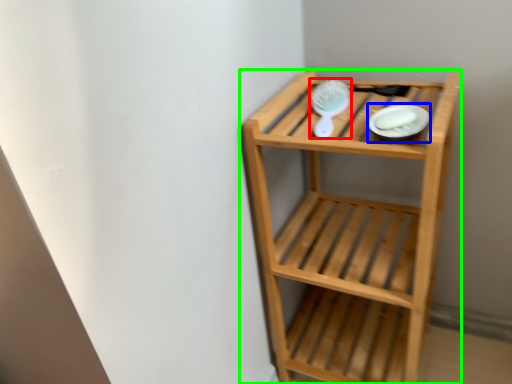
Question: Based on their relative distances, which object is farther from brush (highlighted by a red box)? Choose from platter (highlighted by a blue box) and shelf (highlighted by a green box).

Choices:
 (A) platter
 (B) shelf

Answer: (B)